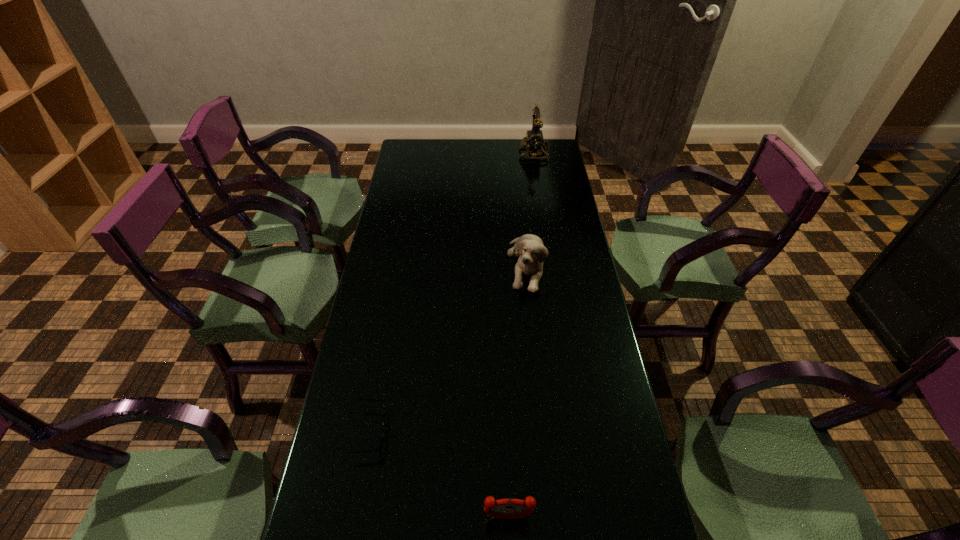
The height and width of the screenshot is (540, 960). I want to click on vacant area that lies between the alarm clock and the third nearest object, so click(517, 391).

Locate an element on the screen. The image size is (960, 540). object that is the second closest to the third shortest object is located at coordinates (378, 446).

I want to click on object that ranks as the third closest to the shortest object, so 534,138.

Identify the location of vacant area that satisfies the following two spatial constraints: 1. on the front of the telephone, featuring the rotary dial; 2. on the front-facing side of the puppy. (552, 265).

I want to click on free spot that satisfies the following two spatial constraints: 1. on the front-facing side of the second tallest object; 2. on the front-facing side of the shortest object, so click(543, 431).

Where is `free space that satisfies the following two spatial constraints: 1. on the front of the telephone, featuring the rotary dial; 2. on the front-facing side of the nearest object`? free space that satisfies the following two spatial constraints: 1. on the front of the telephone, featuring the rotary dial; 2. on the front-facing side of the nearest object is located at coordinates click(x=593, y=517).